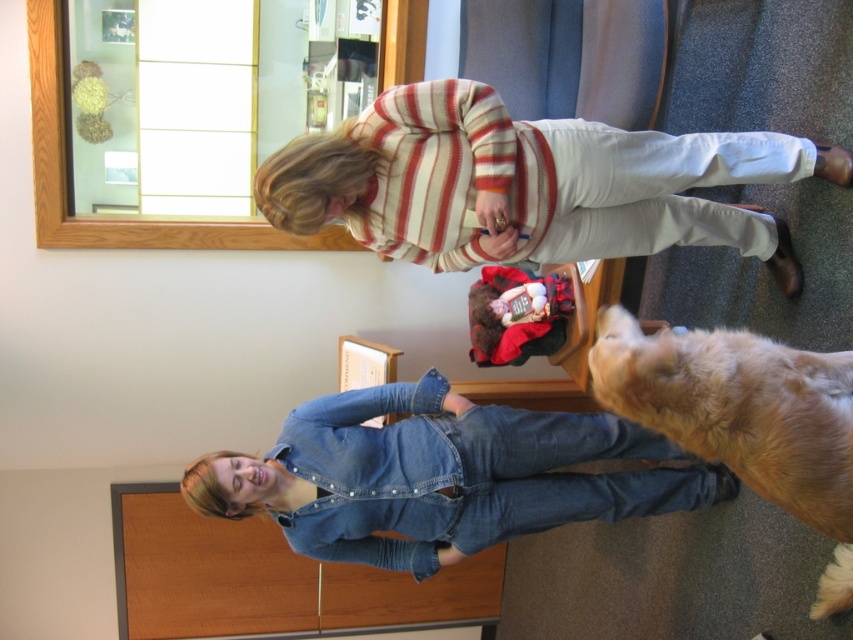
You are a photographer adjusting the camera height to ensure both the denim overalls at lower center and the golden fur dog at lower right are in focus. Based on their heights, which subject should you adjust the camera towards?

The denim overalls at lower center is much taller than the golden fur dog at lower right, so you should adjust the camera towards the golden fur dog at lower right to ensure both are in focus.

Consider the image. You are trying to locate the golden fur dog at lower right in the rotated image. According to the scene description, where would you find it relative to the denim overalls at lower center?

The golden fur dog at lower right is above the denim overalls at lower center.